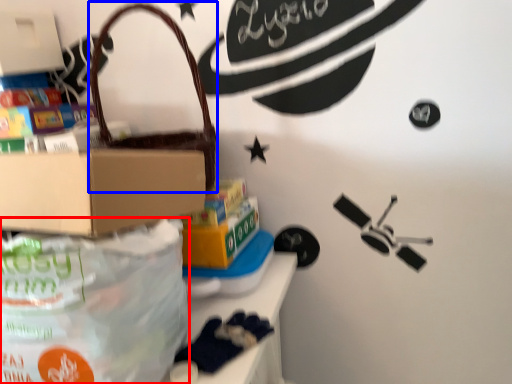
Question: Which object is closer to the camera taking this photo, diaper bag (highlighted by a red box) or handbag (highlighted by a blue box)?

Choices:
 (A) diaper bag
 (B) handbag

Answer: (A)